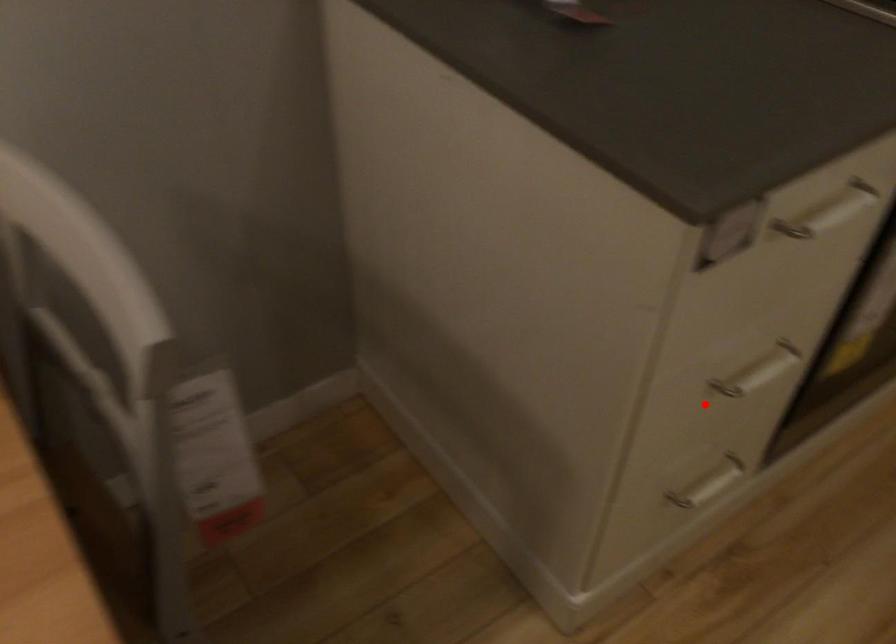
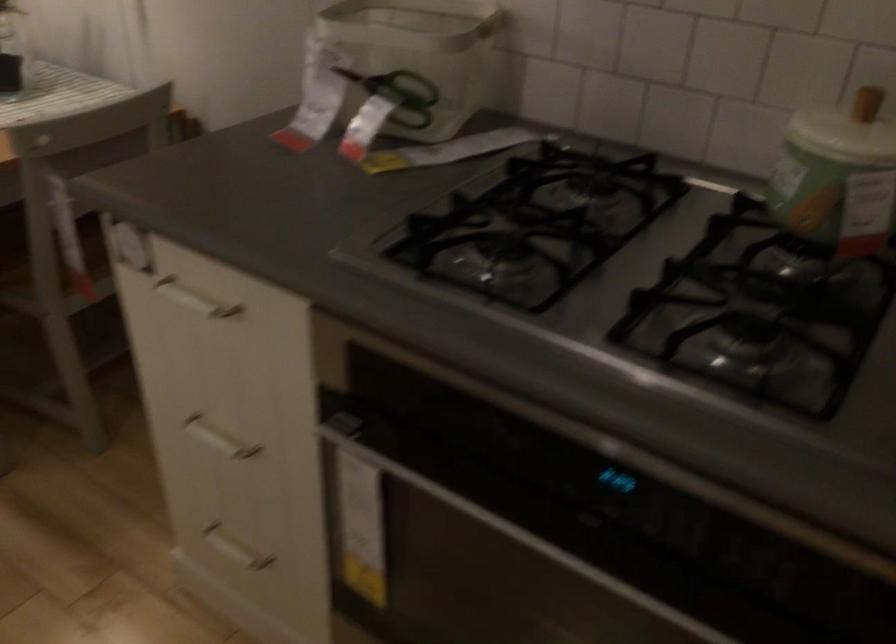
Question: I am providing you with two images of the same scene from different viewpoints. A red point is marked on the first image. At the location where the point appears in image 1, is it still visible in image 2?

Choices:
 (A) Yes
 (B) No

Answer: (A)